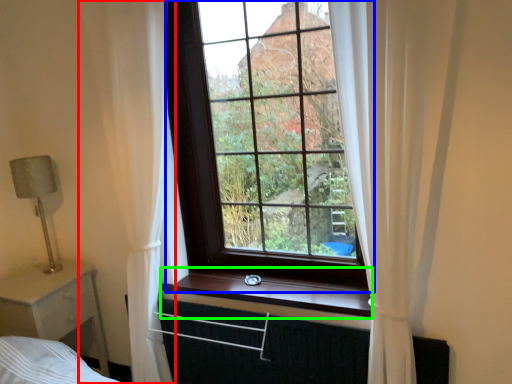
Question: Which object is the farthest from curtain (highlighted by a red box)? Choose among these: window (highlighted by a blue box) or window sill (highlighted by a green box).

Choices:
 (A) window
 (B) window sill

Answer: (B)